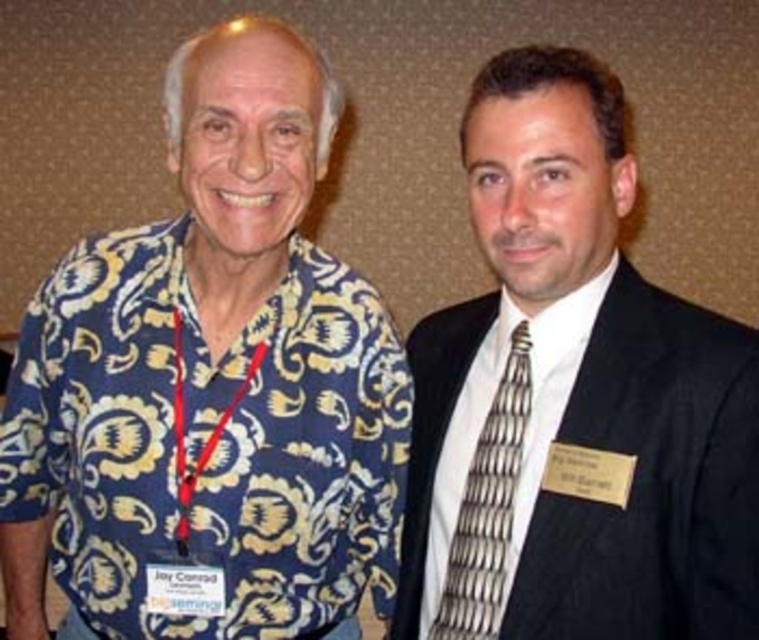
Question: Considering the real-world distances, which object is farthest from the black suit at right?

Choices:
 (A) silver metallic tie at right
 (B) blue floral shirt at left

Answer: (B)

Question: Which point is farther from the camera taking this photo?

Choices:
 (A) (534, 513)
 (B) (167, 484)
 (C) (496, 589)

Answer: (B)

Question: Is blue floral shirt at left to the right of black suit at right from the viewer's perspective?

Choices:
 (A) no
 (B) yes

Answer: (A)

Question: Does blue floral shirt at left appear on the left side of black suit at right?

Choices:
 (A) yes
 (B) no

Answer: (A)

Question: Which object appears closest to the camera in this image?

Choices:
 (A) black suit at right
 (B) blue floral shirt at left
 (C) silver metallic tie at right

Answer: (A)

Question: Is black suit at right to the left of silver metallic tie at right from the viewer's perspective?

Choices:
 (A) yes
 (B) no

Answer: (B)